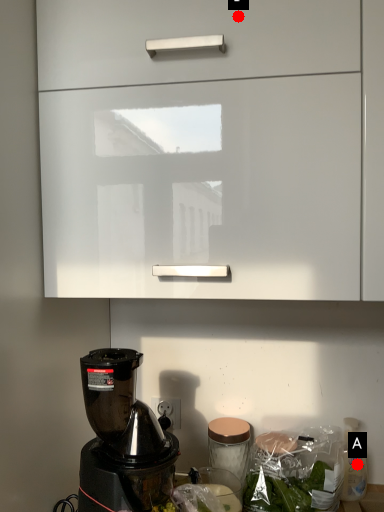
Question: Two points are circled on the image, labeled by A and B beside each circle. Which point appears farthest from the camera in this image?

Choices:
 (A) A is further
 (B) B is further

Answer: (A)